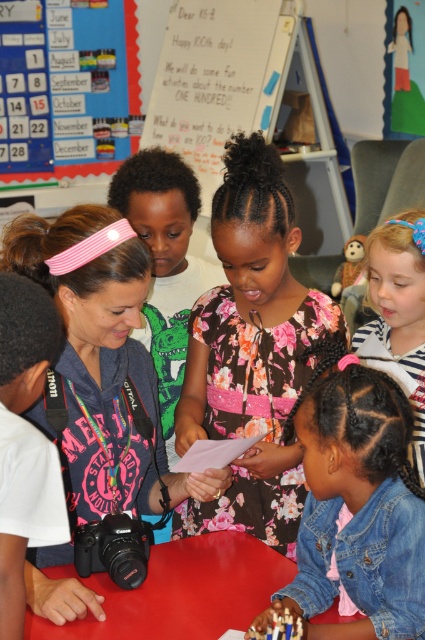
You are a photographer standing behind the adult with the camera. You want to capture a photo of both the denim jacket at lower right and the blue striped shirt at lower right in the same frame. Which clothing item should you focus on first to ensure both are in the shot?

The denim jacket at lower right is shorter than the blue striped shirt at lower right. To ensure both are in the shot, focus on the blue striped shirt at lower right first since it is taller and will require more vertical space in the frame.

Looking at this image, you are a photographer standing at the back of the classroom. You want to take a photo of the floral fabric dress at center and the blue paper calendar at upper left. Can you fit both objects in your camera frame if your camera has a maximum viewing range of 3 meters?

The floral fabric dress at center and the blue paper calendar at upper left are 3.35 meters apart, which exceeds the camera frame viewing range of 3 meters. Therefore, you cannot fit both objects in the frame at the same time.

You are standing in the classroom and see a point marked at coordinates (357, 509). What object is located at that point?

The point at coordinates (357, 509) corresponds to the denim jacket at lower right.